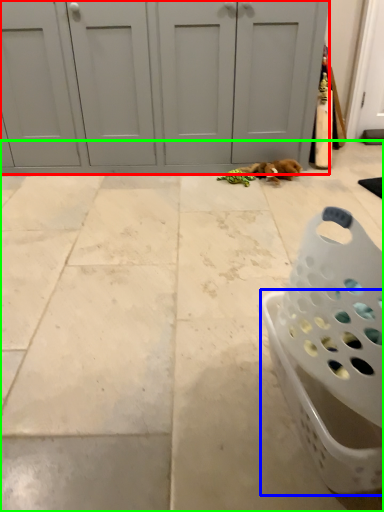
Question: Estimate the real-world distances between objects in this image. Which object is closer to door (highlighted by a red box), basket (highlighted by a blue box) or concrete (highlighted by a green box)?

Choices:
 (A) basket
 (B) concrete

Answer: (B)